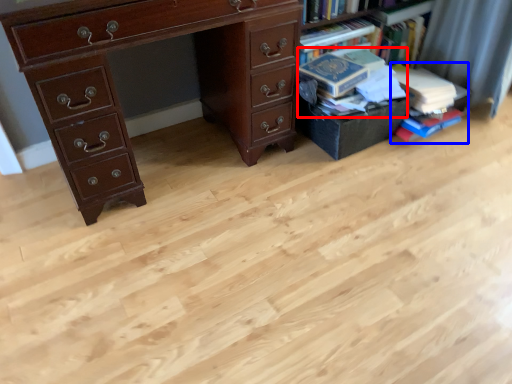
Question: Which of the following is the farthest to the observer, book (highlighted by a red box) or book (highlighted by a blue box)?

Choices:
 (A) book
 (B) book

Answer: (B)